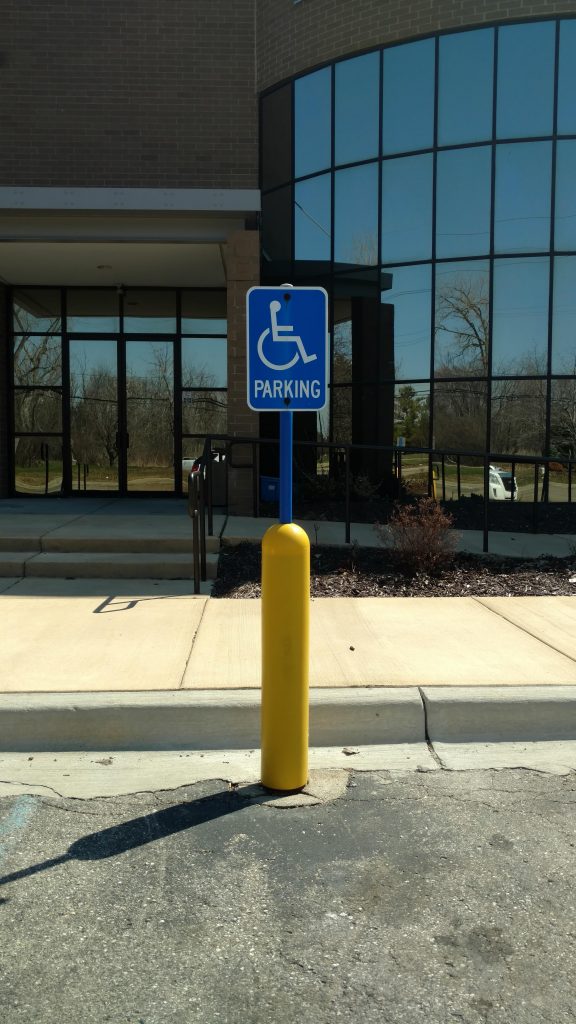
Where is `doors`? The width and height of the screenshot is (576, 1024). doors is located at coordinates [x=104, y=420], [x=138, y=416].